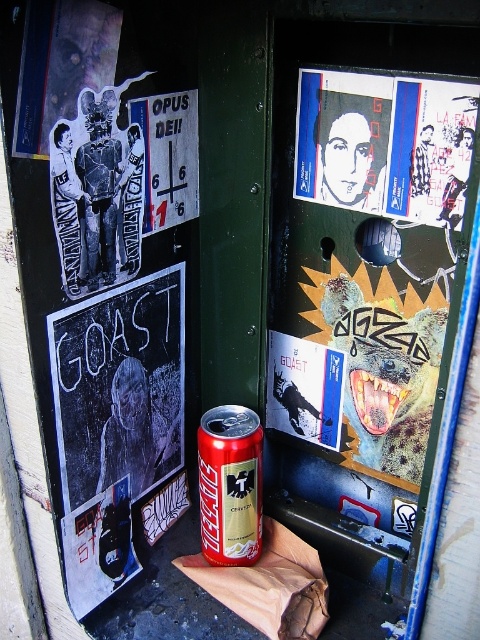
Is black chalkboard at left to the left of metallic gold beer can at center from the viewer's perspective?

Indeed, black chalkboard at left is positioned on the left side of metallic gold beer can at center.

Does black chalkboard at left appear on the right side of metallic gold beer can at center?

No, black chalkboard at left is not to the right of metallic gold beer can at center.

Is point (10, 38) positioned behind point (252, 547)?

That is False.

This screenshot has height=640, width=480. In order to click on black chalkboard at left in this screenshot , I will do `click(107, 308)`.

Is point (100, 209) in front of point (312, 147)?

Yes.

Does black chalkboard at left appear on the right side of white paper poster at upper right?

Incorrect, black chalkboard at left is not on the right side of white paper poster at upper right.

The height and width of the screenshot is (640, 480). Describe the element at coordinates (107, 308) in the screenshot. I see `black chalkboard at left` at that location.

Locate an element on the screen. This screenshot has width=480, height=640. black chalkboard at left is located at coordinates (107, 308).

Which is below, white paper poster at upper right or metallic gold beer can at center?

metallic gold beer can at center

Which is more to the right, white paper poster at upper right or metallic gold beer can at center?

Positioned to the right is white paper poster at upper right.

Describe the element at coordinates (384, 145) in the screenshot. Image resolution: width=480 pixels, height=640 pixels. I see `white paper poster at upper right` at that location.

Where is `white paper poster at upper right`? The height and width of the screenshot is (640, 480). white paper poster at upper right is located at coordinates (384, 145).